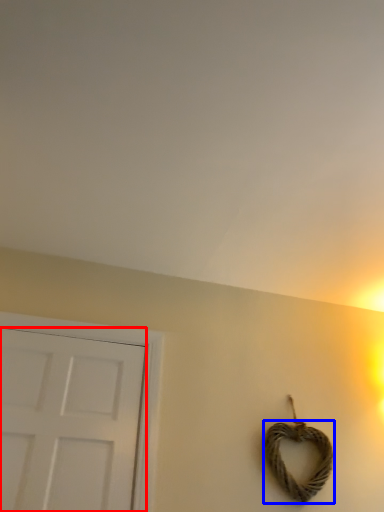
Question: Which object is further to the camera taking this photo, door (highlighted by a red box) or rope (highlighted by a blue box)?

Choices:
 (A) door
 (B) rope

Answer: (B)